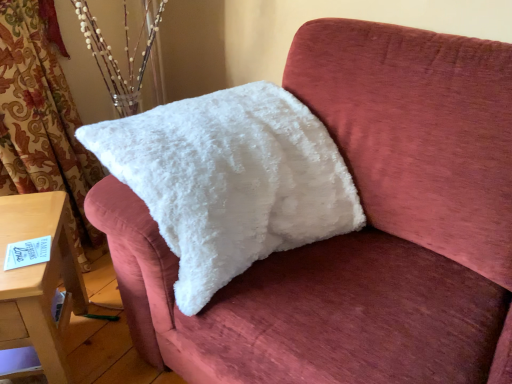
Question: Would you say wooden table at lower left is to the left or to the right of white fluffy pillow at upper left in the picture?

Choices:
 (A) left
 (B) right

Answer: (A)

Question: From a real-world perspective, is wooden table at lower left physically located above or below white fluffy pillow at upper left?

Choices:
 (A) above
 (B) below

Answer: (B)

Question: In the image, is wooden table at lower left positioned in front of or behind white fluffy pillow at upper left?

Choices:
 (A) behind
 (B) front

Answer: (A)

Question: Is point (187, 165) closer or farther from the camera than point (53, 372)?

Choices:
 (A) farther
 (B) closer

Answer: (B)

Question: Based on their sizes in the image, would you say white fluffy pillow at upper left is bigger or smaller than wooden table at lower left?

Choices:
 (A) small
 (B) big

Answer: (B)

Question: In the image, is white fluffy pillow at upper left positioned in front of or behind wooden table at lower left?

Choices:
 (A) front
 (B) behind

Answer: (A)

Question: From the image's perspective, is white fluffy pillow at upper left above or below wooden table at lower left?

Choices:
 (A) below
 (B) above

Answer: (B)